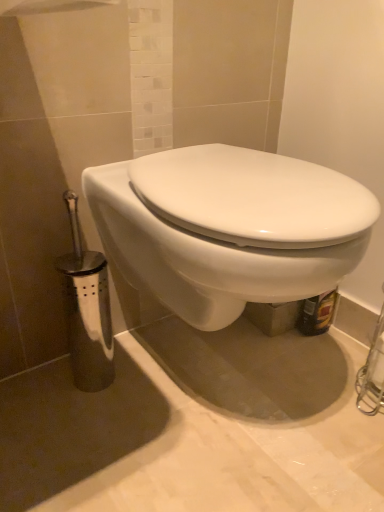
Find the location of a particular element. white glossy toilet at center is located at coordinates (228, 228).

What do you see at coordinates (228, 228) in the screenshot? I see `white glossy toilet at center` at bounding box center [228, 228].

The height and width of the screenshot is (512, 384). I want to click on white glossy toilet at center, so click(x=228, y=228).